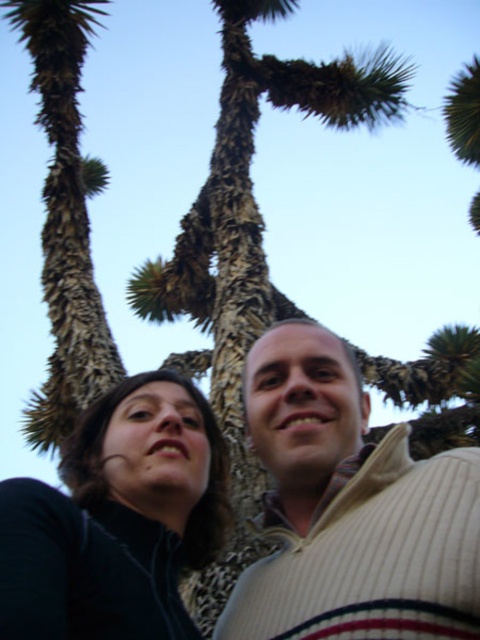
Who is more forward, (136, 588) or (36, 17)?

Point (136, 588) is in front.

Between dark brown sweater at center and brown textured trunk at left, which one has more height?

Standing taller between the two is brown textured trunk at left.

Who is more distant from viewer, [263,561] or [54,276]?

Point [54,276]

Locate an element on the screen. The image size is (480, 640). dark brown sweater at center is located at coordinates (350, 509).

Is point (459, 582) in front of point (205, 532)?

Yes, point (459, 582) is closer to viewer.

Is point (370, 467) farther from camera compared to point (104, 428)?

No, it is not.

Where is `dark brown sweater at center`? This screenshot has height=640, width=480. dark brown sweater at center is located at coordinates (350, 509).

Can you confirm if black matte jacket at lower left is positioned to the right of brown textured trunk at left?

Indeed, black matte jacket at lower left is positioned on the right side of brown textured trunk at left.

Is black matte jacket at lower left thinner than brown textured trunk at left?

Yes, black matte jacket at lower left is thinner than brown textured trunk at left.

The image size is (480, 640). What do you see at coordinates (115, 525) in the screenshot?
I see `black matte jacket at lower left` at bounding box center [115, 525].

This screenshot has width=480, height=640. I want to click on black matte jacket at lower left, so click(x=115, y=525).